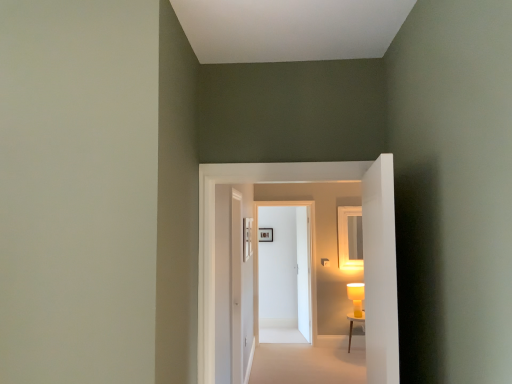
Question: From a real-world perspective, relative to white glossy door at center, the 1th door from the front, is white glossy door at center, positioned as the first door in back-to-front order, vertically above or below?

Choices:
 (A) above
 (B) below

Answer: (B)

Question: Looking at their shapes, would you say white glossy door at center, marked as the third door in a front-to-back arrangement, is wider or thinner than white glossy door at center, the third door when ordered from back to front?

Choices:
 (A) wide
 (B) thin

Answer: (B)

Question: Estimate the real-world distances between objects in this image. Which object is closer to the white glossy door at center, the 1th door from the front?

Choices:
 (A) beige carpet at center
 (B) white glossy door at center, acting as the second door starting from the back
 (C) matte yellow table lamp at right
 (D) white glossy door at center, marked as the third door in a front-to-back arrangement
 (E) matte black picture frame at center

Answer: (A)

Question: Considering the real-world distances, which object is closest to the white glossy door at center, positioned as the first door in back-to-front order?

Choices:
 (A) matte yellow table lamp at right
 (B) white glossy door at center, the 1th door from the front
 (C) white wooden table at lower right
 (D) beige carpet at center
 (E) matte black picture frame at center

Answer: (A)